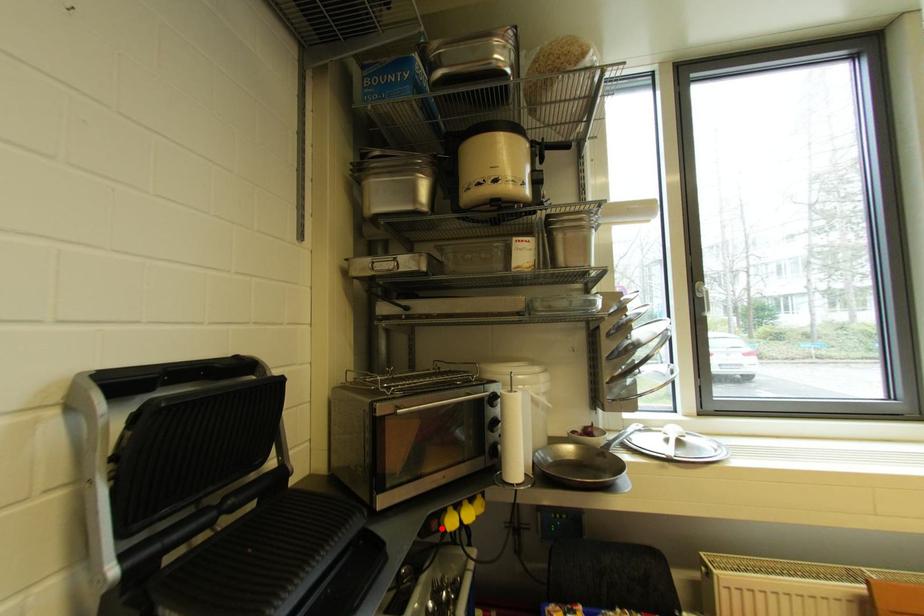
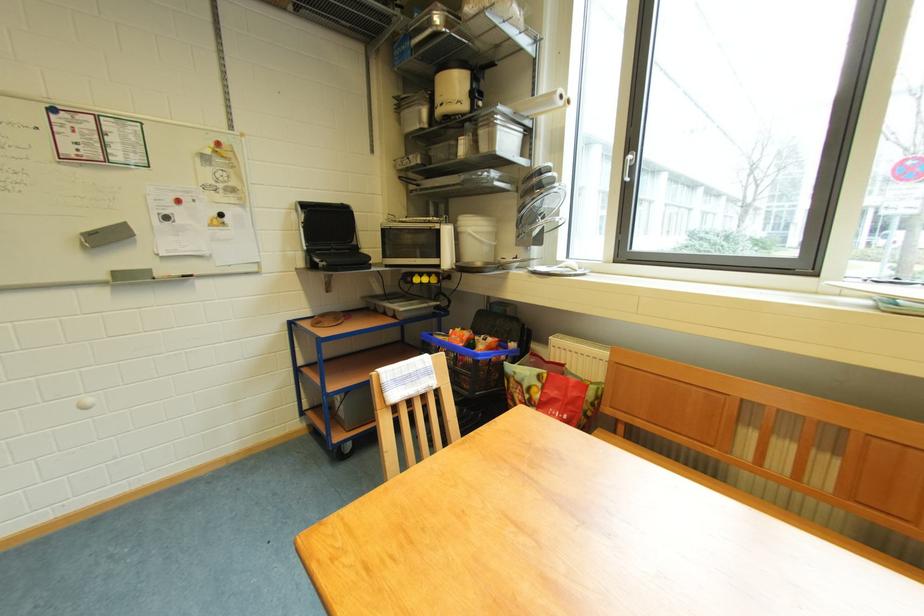
The point at the highlighted location is marked in the first image. Where is the corresponding point in the second image?

(417, 282)